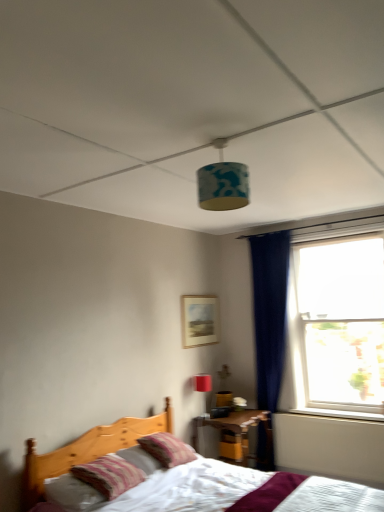
What are the coordinates of `empty space that is ontop of blue fabric lampshade at center (from a real-world perspective)` in the screenshot? It's located at (217, 141).